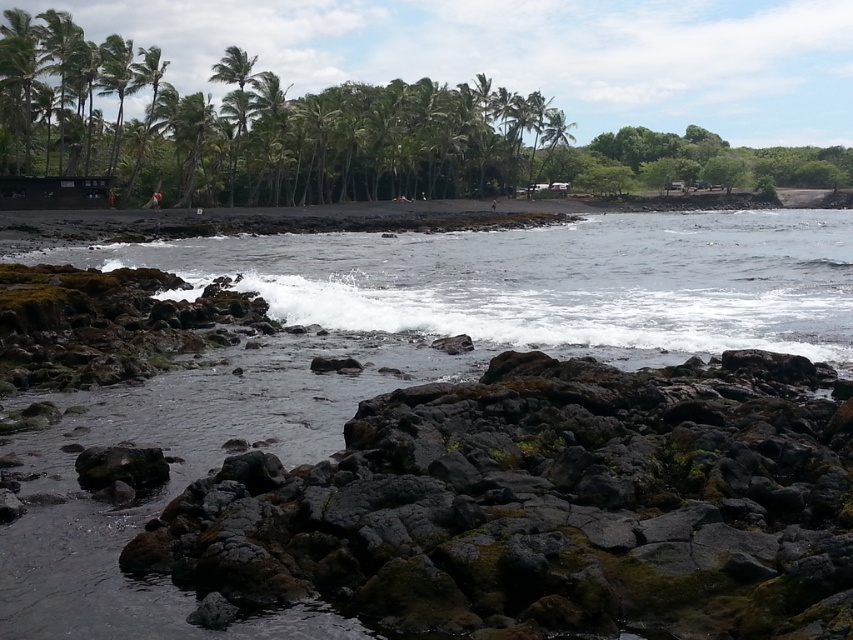
Identify the location of mossy rock at center. Image resolution: width=853 pixels, height=640 pixels. (547, 506).

Does point (657, 586) lie behind point (235, 77)?

No, it is not.

Which is behind, point (732, 490) or point (231, 61)?

The point (231, 61) is behind.

The image size is (853, 640). Identify the location of mossy rock at center. (547, 506).